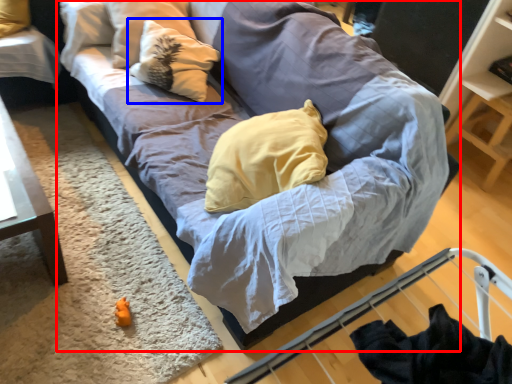
Question: Which point is closer to the camera, studio couch (highlighted by a red box) or pillow (highlighted by a blue box)?

Choices:
 (A) studio couch
 (B) pillow

Answer: (A)